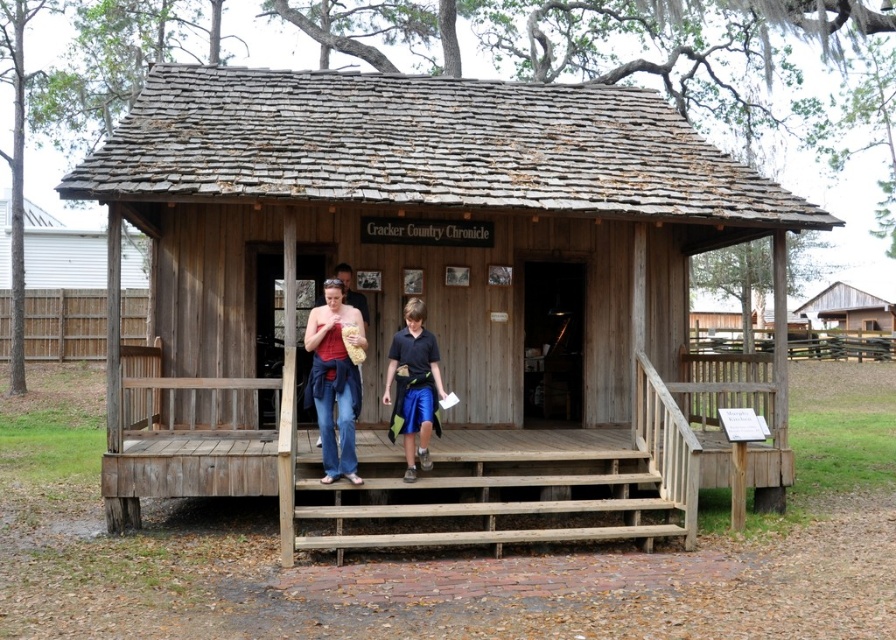
Does denim jeans at center have a larger size compared to matte red tank top at center?

Incorrect, denim jeans at center is not larger than matte red tank top at center.

Who is positioned more to the right, denim jeans at center or matte red tank top at center?

denim jeans at center

Where is `denim jeans at center`? This screenshot has height=640, width=896. denim jeans at center is located at coordinates (334, 378).

Is the position of wooden log cabin at center more distant than that of matte red tank top at center?

No, wooden log cabin at center is in front of matte red tank top at center.

Who is taller, wooden log cabin at center or matte red tank top at center?

With more height is matte red tank top at center.

Is point (566, 241) farther from camera compared to point (326, 282)?

Yes, point (566, 241) is farther from viewer.

At what (x,y) coordinates should I click in order to perform the action: click on wooden log cabin at center. Please return your answer as a coordinate pair (x, y). The image size is (896, 640). Looking at the image, I should click on (438, 289).

Does point (513, 536) lie behind point (326, 385)?

No, (513, 536) is closer to viewer.

The height and width of the screenshot is (640, 896). I want to click on wooden porch at center, so click(479, 461).